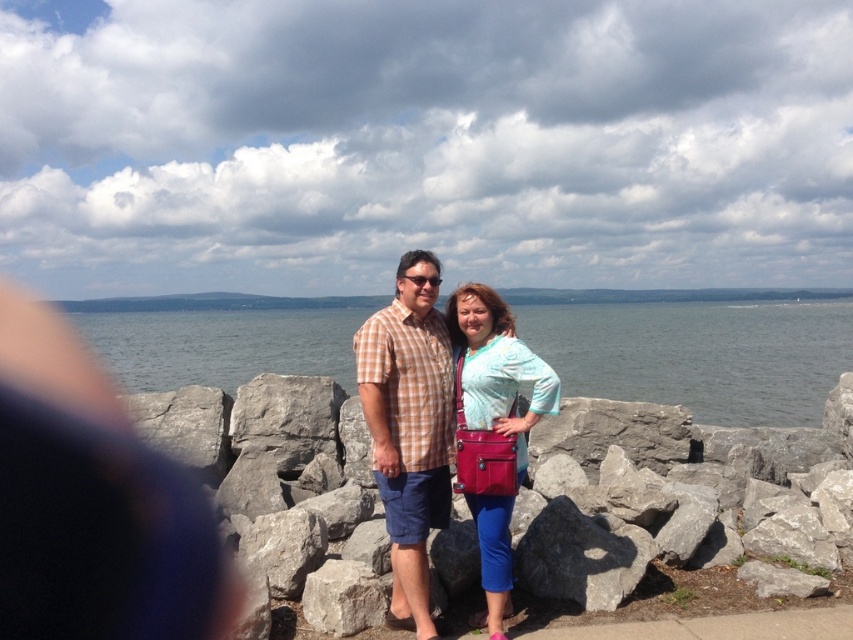
Does checkered fabric shirt at center have a lesser height compared to gray rough rock at center?

Incorrect, checkered fabric shirt at center's height does not fall short of gray rough rock at center's.

Consider the image. Is checkered fabric shirt at center further to camera compared to gray rough rock at center?

No.

Image resolution: width=853 pixels, height=640 pixels. Describe the element at coordinates (409, 428) in the screenshot. I see `checkered fabric shirt at center` at that location.

Where is `checkered fabric shirt at center`? Image resolution: width=853 pixels, height=640 pixels. checkered fabric shirt at center is located at coordinates (409, 428).

Who is taller, checkered fabric shirt at center or matte pink purse at center?

Standing taller between the two is checkered fabric shirt at center.

Can you confirm if checkered fabric shirt at center is bigger than matte pink purse at center?

Yes.

Is point (418, 333) farther from camera compared to point (482, 328)?

Yes.

The width and height of the screenshot is (853, 640). What are the coordinates of `checkered fabric shirt at center` in the screenshot? It's located at (409, 428).

Does gray water at center have a lesser height compared to gray rough rock at center?

In fact, gray water at center may be taller than gray rough rock at center.

Is gray water at center closer to the viewer compared to gray rough rock at center?

That is False.

Is point (144, 337) behind point (642, 534)?

Yes, it is behind point (642, 534).

This screenshot has height=640, width=853. I want to click on gray water at center, so click(x=699, y=355).